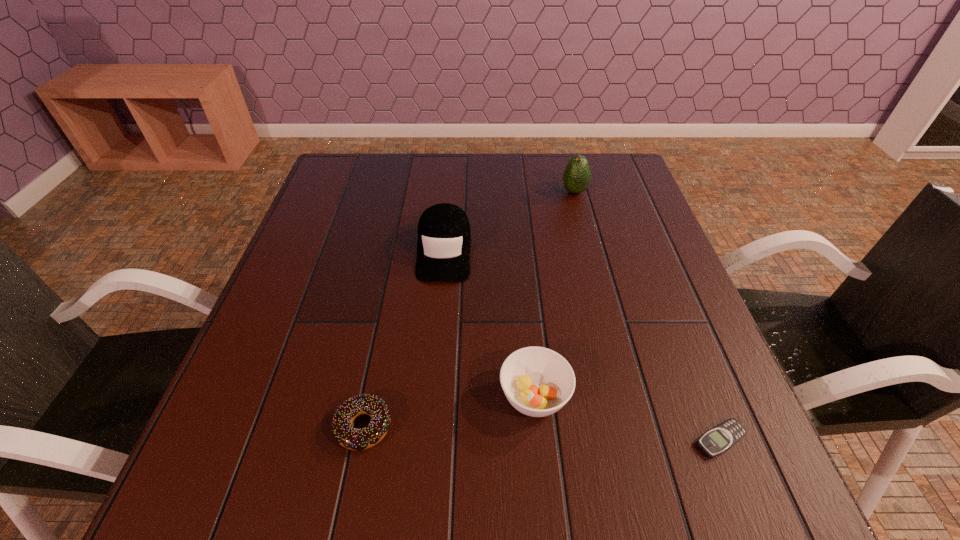
In order to click on avocado in this screenshot , I will do [x=577, y=175].

The image size is (960, 540). Find the location of `the fourth object from left to right`. the fourth object from left to right is located at coordinates (577, 175).

Where is `the fourth nearest object`? the fourth nearest object is located at coordinates (444, 239).

Locate an element on the screen. Image resolution: width=960 pixels, height=540 pixels. cap is located at coordinates (444, 239).

In order to click on the third shortest object in this screenshot , I will do `click(537, 381)`.

Image resolution: width=960 pixels, height=540 pixels. Find the location of `the third object from left to right`. the third object from left to right is located at coordinates (537, 381).

The image size is (960, 540). What are the coordinates of `doughnut` in the screenshot? It's located at (346, 435).

This screenshot has height=540, width=960. What are the coordinates of `the shortest object` in the screenshot? It's located at (720, 438).

You are a GUI agent. You are given a task and a screenshot of the screen. Output one action in this format:
    pyautogui.click(x=<x>, y=<y>)
    Task: Click on the beeper
    The image size is (960, 540).
    Given the screenshot: What is the action you would take?
    pyautogui.click(x=720, y=438)

This screenshot has height=540, width=960. I want to click on vacant space located on the back of the tallest object, so click(x=566, y=159).